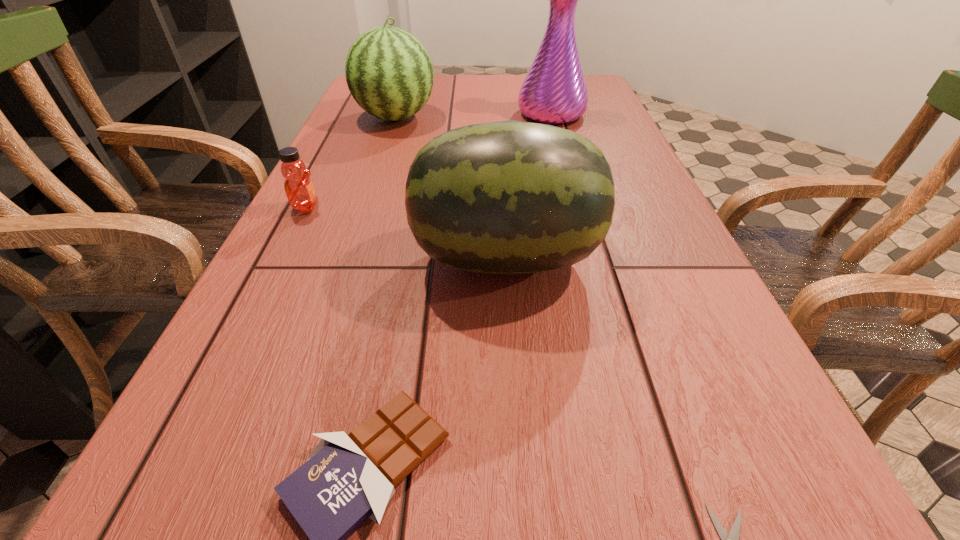
Locate an element on the screen. vase that is at the far edge is located at coordinates (554, 91).

Where is `watermelon that is at the far edge`? This screenshot has width=960, height=540. watermelon that is at the far edge is located at coordinates (389, 73).

You are a GUI agent. You are given a task and a screenshot of the screen. Output one action in this format:
    pyautogui.click(x=<x>, y=<y>)
    Task: Click on the watermelon present at the left edge
    Image resolution: width=960 pixels, height=540 pixels.
    Given the screenshot: What is the action you would take?
    pyautogui.click(x=389, y=73)

Identify the location of honey at the left edge. This screenshot has height=540, width=960. (299, 188).

Where is `object located at the right edge`? Image resolution: width=960 pixels, height=540 pixels. object located at the right edge is located at coordinates (554, 91).

What are the coordinates of `object located in the far left corner section of the desktop` in the screenshot? It's located at (389, 73).

In order to click on object at the far right corner in this screenshot , I will do `click(554, 91)`.

The width and height of the screenshot is (960, 540). What are the coordinates of `vacant point at the left edge` in the screenshot? It's located at [369, 178].

I want to click on vacant space at the right edge of the desktop, so click(x=768, y=488).

Locate an element on the screen. vacant space that is in between the third shortest object and the left watermelon is located at coordinates (351, 163).